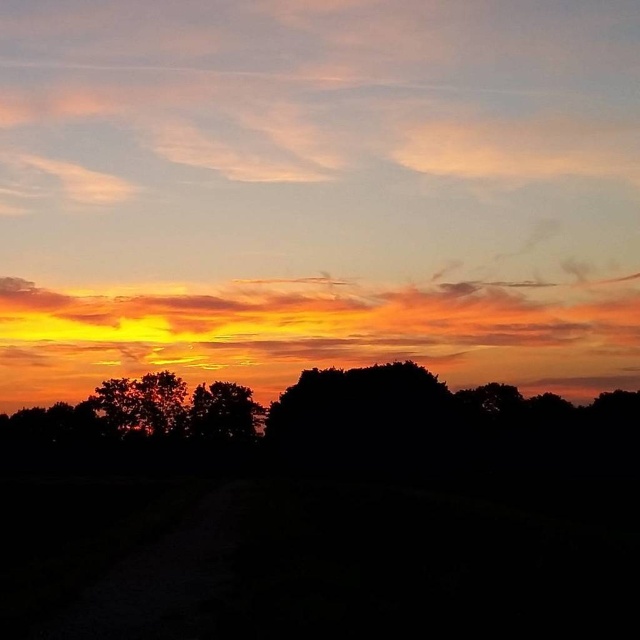
Question: Among these points, which one is farthest from the camera?

Choices:
 (A) (344, 160)
 (B) (189, 429)

Answer: (A)

Question: Where is orange translucent cloud at upper center located in relation to silhouette tree at center in the image?

Choices:
 (A) below
 (B) above

Answer: (B)

Question: Which of the following is the closest to the observer?

Choices:
 (A) orange translucent cloud at upper center
 (B) silhouette tree at center

Answer: (A)

Question: Which object appears closest to the camera in this image?

Choices:
 (A) silhouette tree at center
 (B) orange translucent cloud at upper center

Answer: (B)

Question: Can you confirm if orange translucent cloud at upper center is positioned to the right of silhouette tree at center?

Choices:
 (A) no
 (B) yes

Answer: (B)

Question: Is orange translucent cloud at upper center below silhouette tree at center?

Choices:
 (A) no
 (B) yes

Answer: (A)